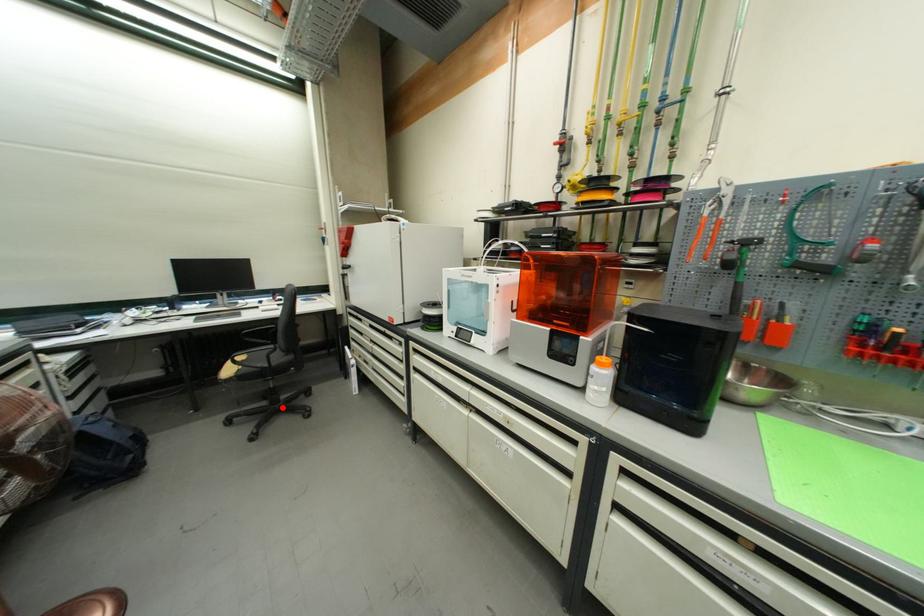
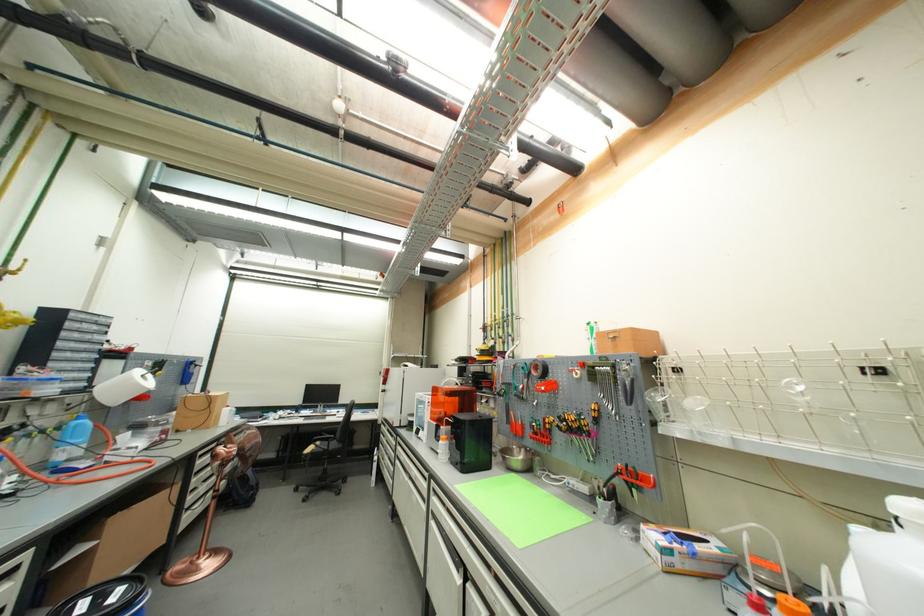
Question: A red point is marked in image1. In image2, is the corresponding 3D point closer to the camera or farther? Reply with the corresponding letter.

Choices:
 (A) The corresponding 3D point is closer.
 (B) The corresponding 3D point is farther.

Answer: (B)